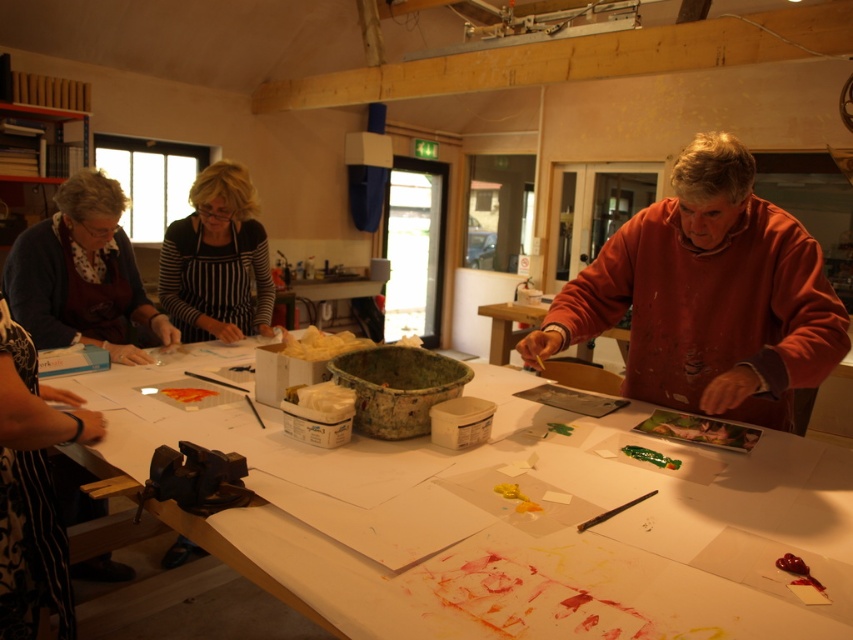
You are an artist entering the studio and see the matte black apron at left and the striped apron at center. Which apron is closer to you?

The matte black apron at left is closer to you because it is in front of the striped apron at center.

You are an artist who needs to take a photo of your work. You have a matte black apron at left and a camera. Which object is closer to you?

The matte black apron at left is closer to you since it is 2.21 meters away from the camera.

You are an artist trying to place a large canvas on the white paper at center and the matte wooden table at center. Which surface can accommodate the canvas better based on their sizes?

The white paper at center is larger in size than the matte wooden table at center, so it can accommodate the canvas better.